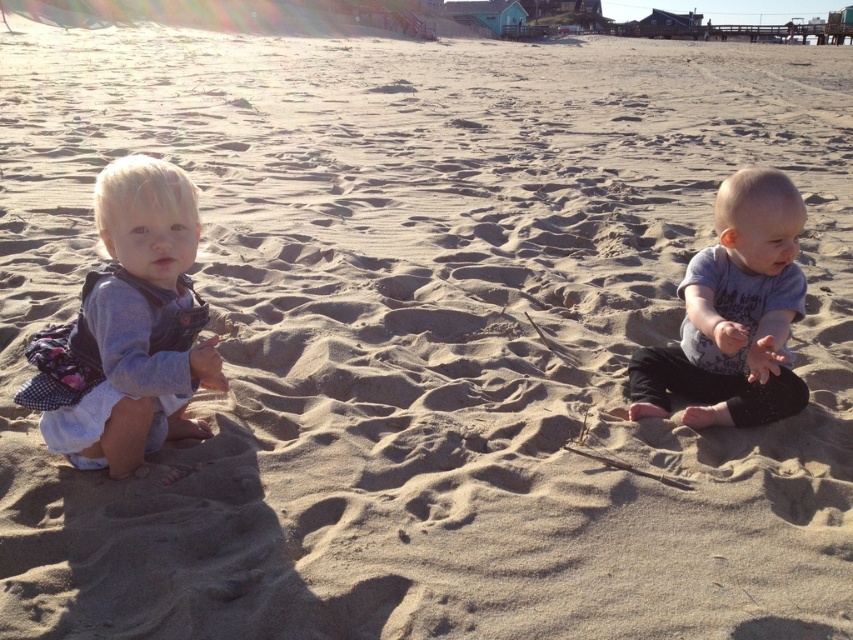
You are a photographer trying to capture the children in the scene. You want to ensure both the matte gray vest at left and the light blue cotton shirt at center are clearly visible in your shot. Based on their positions, which clothing item will appear closer to the bottom of the photo?

The matte gray vest at left will appear closer to the bottom of the photo because it is positioned under the light blue cotton shirt at center.

You are a photographer trying to capture both children in the scene. The child wearing the matte gray vest at left is positioned at coordinates approximately 0.517 on the x and 0.154 on the y. Where should you position your camera to ensure both children are in frame?

The matte gray vest at left is located at point (x=131, y=330), so you should position your camera centrally between the two children to ensure both are in frame.

You are a parent trying to dress your child in a new outfit. You have two options in the image, the matte gray vest at left and the light blue cotton shirt at center. Which one is bigger?

The matte gray vest at left is larger than the light blue cotton shirt at center.